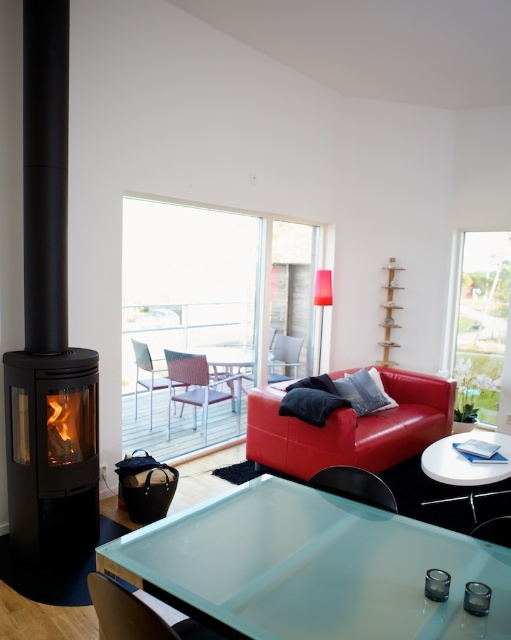
Question: Where is black glass fireplace at left located in relation to matte black armchair at lower left in the image?

Choices:
 (A) left
 (B) right

Answer: (A)

Question: Which point appears closest to the camera in this image?

Choices:
 (A) (289, 376)
 (B) (280, 349)
 (C) (480, 529)
 (D) (243, 378)

Answer: (C)

Question: Can you confirm if transparent glass table at center is positioned to the left of black glass fireplace at left?

Choices:
 (A) no
 (B) yes

Answer: (A)

Question: Estimate the real-world distances between objects in this image. Which object is closer to the metallic purple armchair at center?

Choices:
 (A) metallic glass table at center
 (B) matte black armchair at lower right

Answer: (A)

Question: Is black matte fireplace at left bigger than matte gray armchair at center?

Choices:
 (A) no
 (B) yes

Answer: (B)

Question: Which of the following is the closest to the observer?

Choices:
 (A) (328, 572)
 (B) (272, 364)
 (C) (297, 342)
 (D) (288, 444)

Answer: (A)